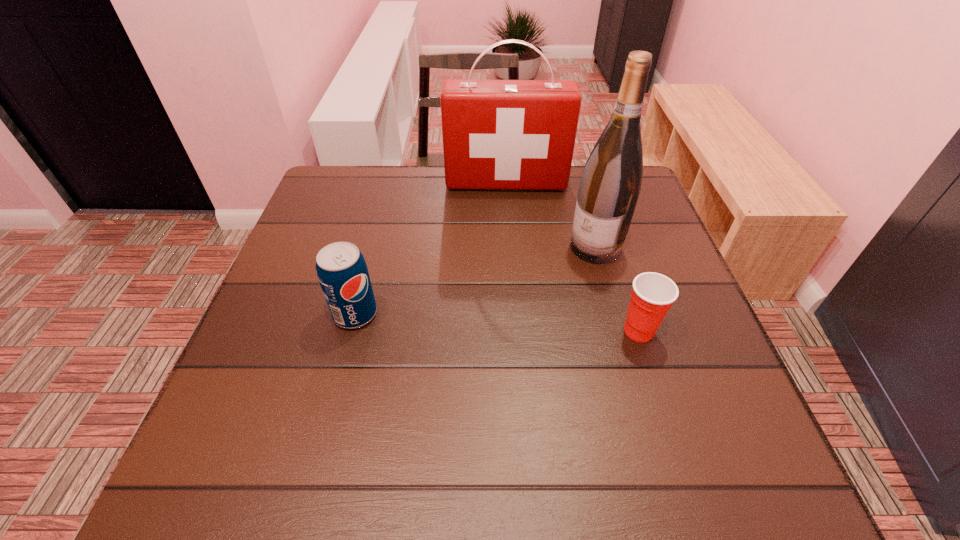
Where is `free space on the desktop that is between the pop and the Dixie cup and is positioned on the label of the wine bottle`? The image size is (960, 540). free space on the desktop that is between the pop and the Dixie cup and is positioned on the label of the wine bottle is located at coordinates pos(500,323).

Locate an element on the screen. The height and width of the screenshot is (540, 960). vacant spot on the desktop that is between the third tallest object and the shortest object and is positioned on the front face of the third shortest object is located at coordinates (512, 323).